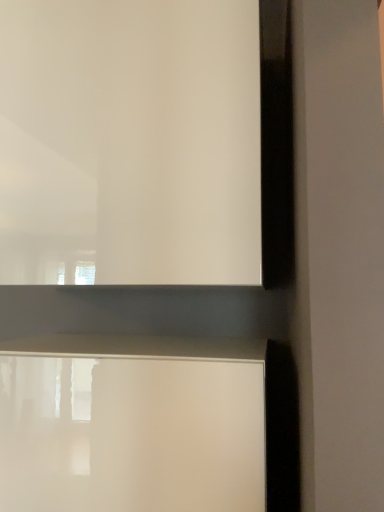
Question: Considering the relative sizes of white glossy window frame at upper center and white glossy table at lower center in the image provided, is white glossy window frame at upper center bigger than white glossy table at lower center?

Choices:
 (A) no
 (B) yes

Answer: (B)

Question: Considering the relative sizes of white glossy window frame at upper center and white glossy table at lower center in the image provided, is white glossy window frame at upper center wider than white glossy table at lower center?

Choices:
 (A) yes
 (B) no

Answer: (A)

Question: Does white glossy window frame at upper center appear on the right side of white glossy table at lower center?

Choices:
 (A) yes
 (B) no

Answer: (A)

Question: Is the depth of white glossy window frame at upper center greater than that of white glossy table at lower center?

Choices:
 (A) no
 (B) yes

Answer: (B)

Question: Are white glossy window frame at upper center and white glossy table at lower center located far from each other?

Choices:
 (A) yes
 (B) no

Answer: (B)

Question: Can white glossy table at lower center be found inside white glossy window frame at upper center?

Choices:
 (A) no
 (B) yes

Answer: (A)

Question: Can you confirm if white glossy table at lower center is thinner than white glossy window frame at upper center?

Choices:
 (A) no
 (B) yes

Answer: (B)

Question: From a real-world perspective, is white glossy table at lower center positioned under white glossy window frame at upper center based on gravity?

Choices:
 (A) no
 (B) yes

Answer: (B)

Question: Can you confirm if white glossy table at lower center is shorter than white glossy window frame at upper center?

Choices:
 (A) yes
 (B) no

Answer: (A)

Question: Can you confirm if white glossy table at lower center is positioned to the left of white glossy window frame at upper center?

Choices:
 (A) no
 (B) yes

Answer: (B)

Question: Does white glossy table at lower center have a greater width compared to white glossy window frame at upper center?

Choices:
 (A) yes
 (B) no

Answer: (B)

Question: Is white glossy table at lower center behind white glossy window frame at upper center?

Choices:
 (A) yes
 (B) no

Answer: (B)

Question: From a real-world perspective, is white glossy table at lower center positioned above or below white glossy window frame at upper center?

Choices:
 (A) below
 (B) above

Answer: (A)